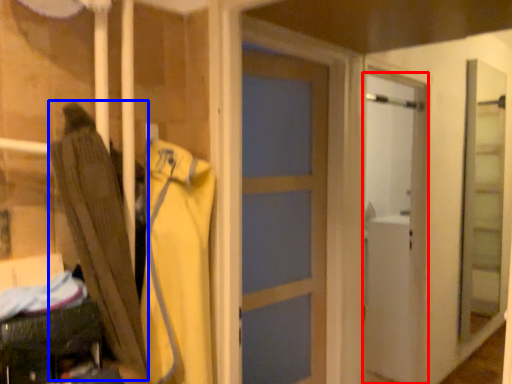
Question: Which point is closer to the camera, door (highlighted by a red box) or umbrella (highlighted by a blue box)?

Choices:
 (A) door
 (B) umbrella

Answer: (B)